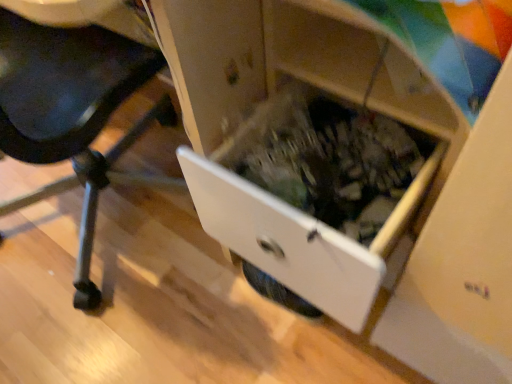
Find the location of `white plastic drawer at lower right`. white plastic drawer at lower right is located at coordinates (73, 113).

The image size is (512, 384). What do you see at coordinates (73, 113) in the screenshot?
I see `white plastic drawer at lower right` at bounding box center [73, 113].

Image resolution: width=512 pixels, height=384 pixels. What do you see at coordinates (298, 238) in the screenshot?
I see `wooden drawer at center` at bounding box center [298, 238].

At what (x,y) coordinates should I click in order to perform the action: click on wooden drawer at center. Please return your answer as a coordinate pair (x, y). This screenshot has width=512, height=384. Looking at the image, I should click on (298, 238).

Where is `white plastic drawer at lower right`? white plastic drawer at lower right is located at coordinates (73, 113).

Based on their positions, is white plastic drawer at lower right located to the left or right of wooden drawer at center?

white plastic drawer at lower right is positioned on wooden drawer at center's left side.

Between white plastic drawer at lower right and wooden drawer at center, which one is positioned behind?

wooden drawer at center.

Considering the positions of points (90, 162) and (350, 269), is point (90, 162) closer to camera compared to point (350, 269)?

No, it is not.

From the image's perspective, between white plastic drawer at lower right and wooden drawer at center, who is located below?

wooden drawer at center is shown below in the image.

Looking at this image, from a real-world perspective, is white plastic drawer at lower right physically located above or below wooden drawer at center?

In terms of real-world spatial position, white plastic drawer at lower right is above wooden drawer at center.

Does white plastic drawer at lower right have a lesser width compared to wooden drawer at center?

In fact, white plastic drawer at lower right might be wider than wooden drawer at center.

Considering the sizes of objects white plastic drawer at lower right and wooden drawer at center in the image provided, who is taller, white plastic drawer at lower right or wooden drawer at center?

white plastic drawer at lower right.

Considering the relative sizes of white plastic drawer at lower right and wooden drawer at center in the image provided, is white plastic drawer at lower right bigger than wooden drawer at center?

Yes, white plastic drawer at lower right is bigger than wooden drawer at center.

Do you think white plastic drawer at lower right is within wooden drawer at center, or outside of it?

The correct answer is: outside.

Does white plastic drawer at lower right touch wooden drawer at center?

white plastic drawer at lower right is not next to wooden drawer at center, and they're not touching.

Is white plastic drawer at lower right facing away from wooden drawer at center?

white plastic drawer at lower right does not have its back to wooden drawer at center.

Identify the location of drawer on the right of the white plastic drawer at lower right. This screenshot has width=512, height=384. (298, 238).

Which is more to the left, wooden drawer at center or white plastic drawer at lower right?

white plastic drawer at lower right is more to the left.

Does wooden drawer at center lie behind white plastic drawer at lower right?

Yes, it is.

Between point (424, 174) and point (12, 129), which one is positioned behind?

The point (12, 129) is farther from the camera.

From the image's perspective, would you say wooden drawer at center is shown under white plastic drawer at lower right?

Yes.

From a real-world perspective, is wooden drawer at center located beneath white plastic drawer at lower right?

Yes.

Does wooden drawer at center have a lesser width compared to white plastic drawer at lower right?

Yes, wooden drawer at center is thinner than white plastic drawer at lower right.

Who is taller, wooden drawer at center or white plastic drawer at lower right?

white plastic drawer at lower right.

Consider the image. Does wooden drawer at center have a larger size compared to white plastic drawer at lower right?

No.

Would you say white plastic drawer at lower right is part of wooden drawer at center's contents?

No.

Does wooden drawer at center touch white plastic drawer at lower right?

No, wooden drawer at center is not touching white plastic drawer at lower right.

Is wooden drawer at center turned away from white plastic drawer at lower right?

No, wooden drawer at center is not facing the opposite direction of white plastic drawer at lower right.

The image size is (512, 384). I want to click on furniture on the left of the wooden drawer at center, so click(73, 113).

You are a GUI agent. You are given a task and a screenshot of the screen. Output one action in this format:
    pyautogui.click(x=<x>, y=<y>)
    Task: Click on the drawer that appears behind the white plastic drawer at lower right
    This screenshot has width=512, height=384.
    Given the screenshot: What is the action you would take?
    pyautogui.click(x=298, y=238)

I want to click on drawer below the white plastic drawer at lower right (from a real-world perspective), so click(298, 238).